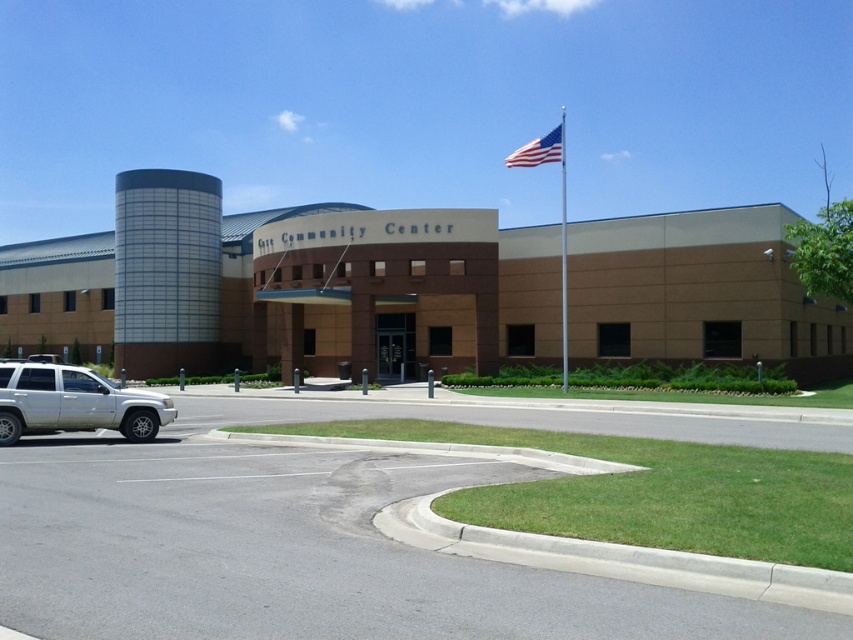
Question: Can you confirm if silver metallic suv at lower left is wider than metallic silver flag pole at upper right?

Choices:
 (A) no
 (B) yes

Answer: (A)

Question: Which object appears closest to the camera in this image?

Choices:
 (A) american flag at upper right
 (B) silver metallic suv at lower left
 (C) metallic silver flag pole at upper right

Answer: (B)

Question: Which point is farther from the camera taking this photo?

Choices:
 (A) (561, 349)
 (B) (526, 144)

Answer: (B)

Question: Can you confirm if silver metallic suv at lower left is wider than metallic silver flag pole at upper right?

Choices:
 (A) yes
 (B) no

Answer: (B)

Question: Which object is closer to the camera taking this photo?

Choices:
 (A) metallic silver flag pole at upper right
 (B) silver metallic suv at lower left

Answer: (B)

Question: Is silver metallic suv at lower left thinner than american flag at upper right?

Choices:
 (A) no
 (B) yes

Answer: (B)